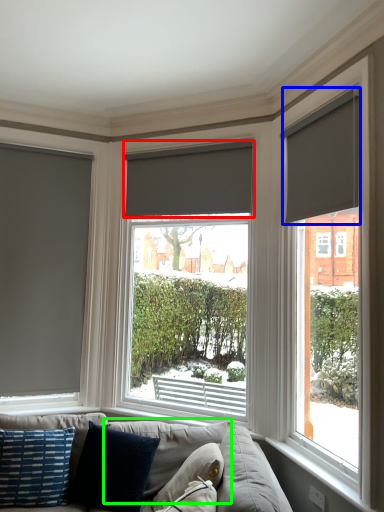
Question: Based on their relative distances, which object is nearer to window blind (highlighted by a red box)? Choose from window blind (highlighted by a blue box) and pillow (highlighted by a green box).

Choices:
 (A) window blind
 (B) pillow

Answer: (A)